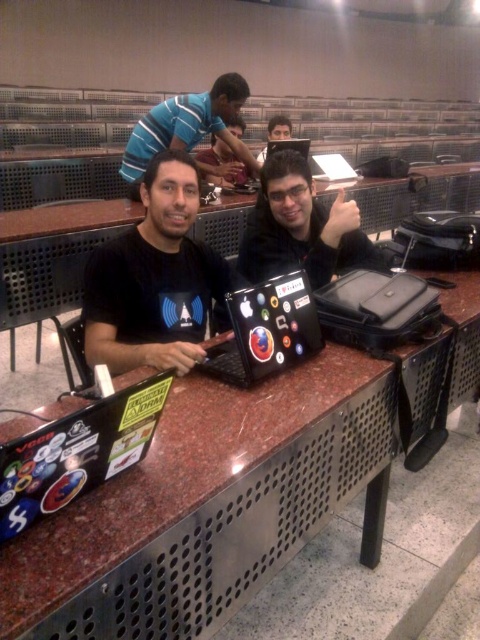
Question: Does blue striped shirt at upper center have a larger size compared to glossy black laptop at center?

Choices:
 (A) yes
 (B) no

Answer: (A)

Question: Does glossy plastic laptop at center appear over blue striped shirt at upper center?

Choices:
 (A) no
 (B) yes

Answer: (A)

Question: Which of the following is the farthest from the observer?

Choices:
 (A) (243, 289)
 (B) (151, 140)
 (C) (180, 268)

Answer: (B)

Question: Estimate the real-world distances between objects in this image. Which object is closer to the matte black laptop at center?

Choices:
 (A) blue striped shirt at upper center
 (B) glossy plastic laptop at center
 (C) glossy black laptop at center
 (D) black matte shirt at center

Answer: (D)

Question: Which point is farther to the camera?

Choices:
 (A) (263, 262)
 (B) (262, 304)
 (C) (302, 150)

Answer: (C)

Question: Is glossy plastic laptop at center smaller than glossy black laptop at center?

Choices:
 (A) no
 (B) yes

Answer: (B)